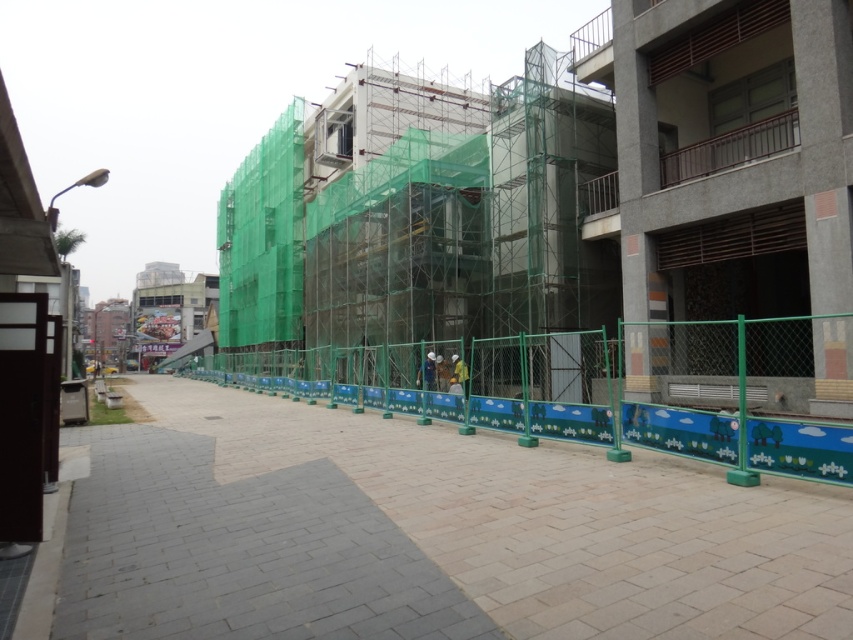
You are standing on the pedestrian walkway and see the construction site enclosed by a green safety fence. There is a point at coordinates (x=426, y=372) in the image. What object or person is located at that point?

The point at coordinates (x=426, y=372) corresponds to a blue fabric construction worker at center.

You are a pedestrian walking on the sidewalk and see the green mesh scaffolding at center and the yellow fabric construction worker at center. Which object is taller?

The green mesh scaffolding at center is taller than the yellow fabric construction worker at center.